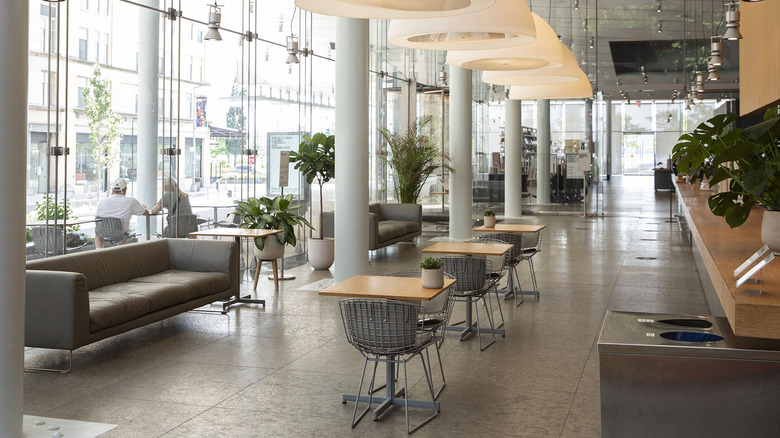
What are the coordinates of `tables` in the screenshot? It's located at (408, 284), (470, 253), (516, 223), (250, 229).